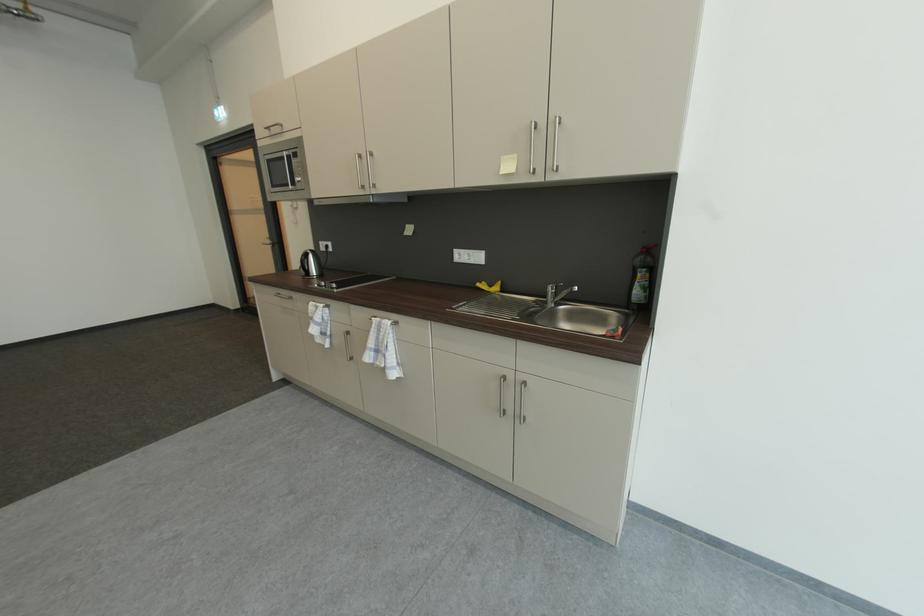
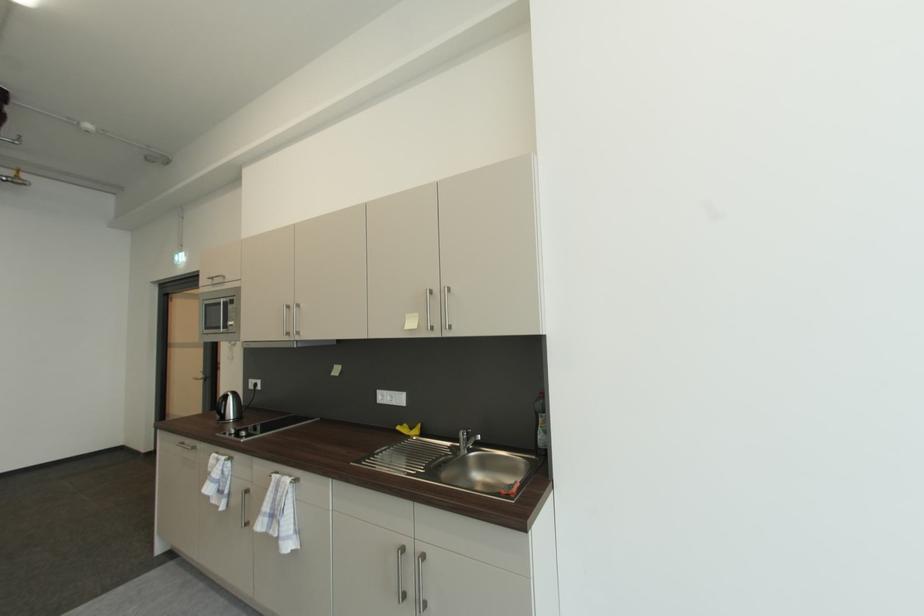
Locate, in the second image, the point that corresponds to point 367,158 in the first image.

(295, 309)